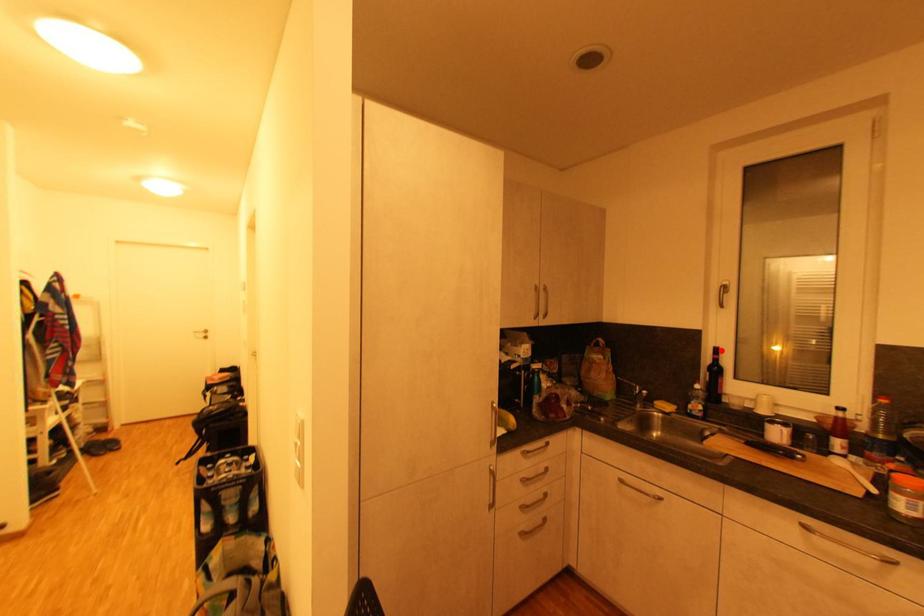
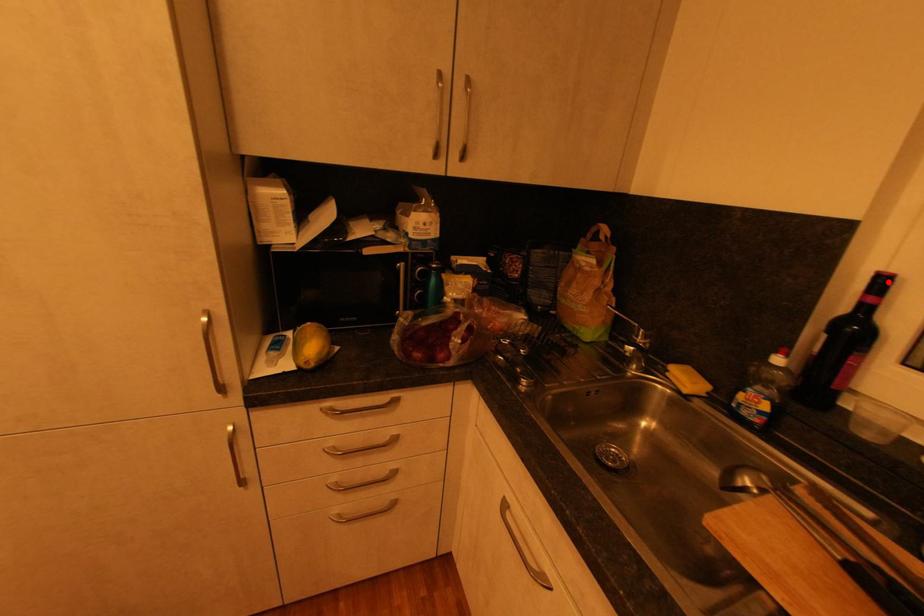
Consider the image. I am providing you with two images of the same scene from different viewpoints. A red point is marked on the first image and another point is marked on the second image. Is the marked point in image1 the same physical position as the marked point in image2?

Yes